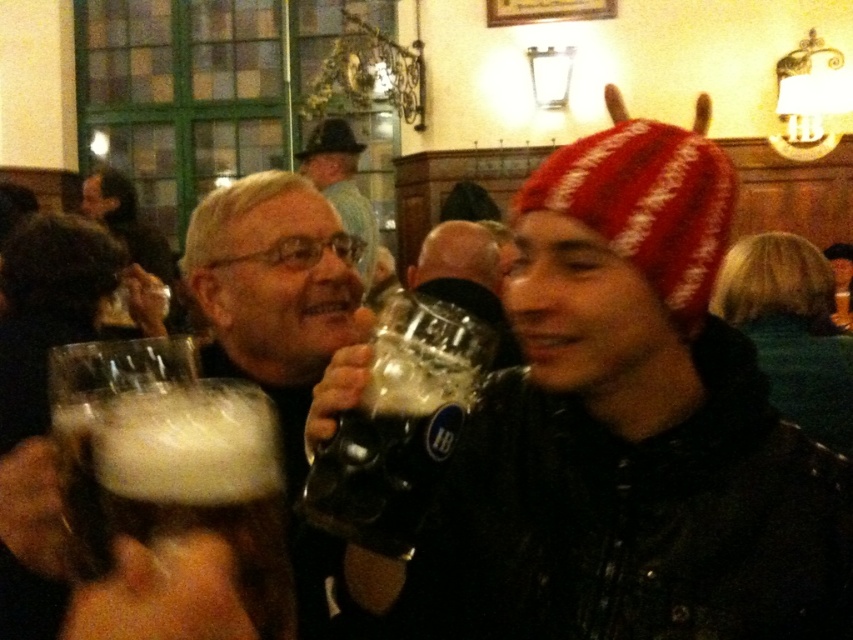
Question: Which point is farther to the camera?

Choices:
 (A) brushed metal hat at upper center
 (B) matte black mug at center

Answer: (A)

Question: Which of the following is the farthest from the observer?

Choices:
 (A) (352, 179)
 (B) (102, 385)

Answer: (A)

Question: Is matte black mug at center below matte black beer mug at center?

Choices:
 (A) no
 (B) yes

Answer: (B)

Question: Among these objects, which one is nearest to the camera?

Choices:
 (A) matte black beer mug at center
 (B) brushed metal hat at upper center
 (C) matte black mug at center
 (D) foamy brown glass at lower left

Answer: (D)

Question: Where is matte black mug at center located in relation to foamy brown glass at lower left in the image?

Choices:
 (A) below
 (B) above

Answer: (B)

Question: In this image, where is matte black mug at center located relative to brushed metal hat at upper center?

Choices:
 (A) right
 (B) left

Answer: (A)